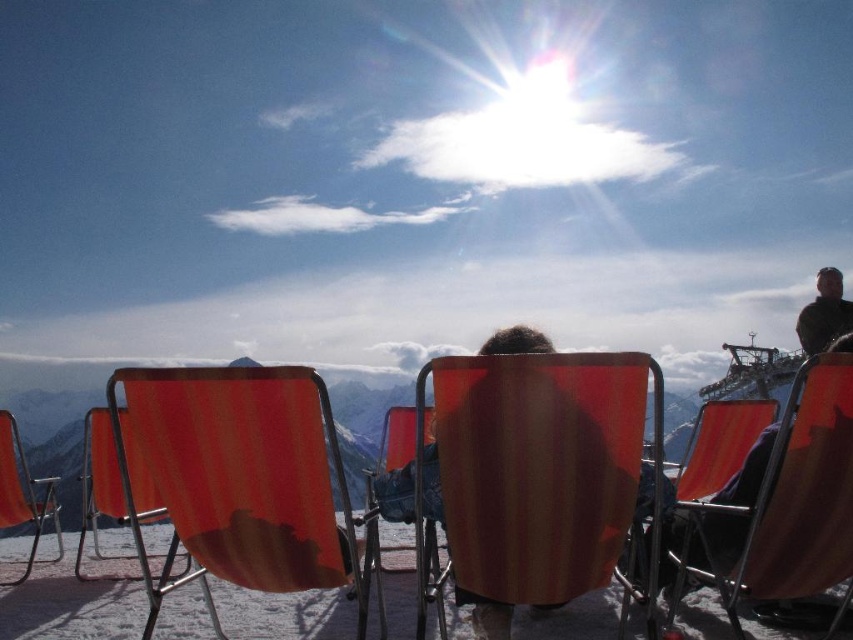
Who is lower down, orange fabric chair at center or matte orange chair at left?

matte orange chair at left is below.

Does orange fabric chair at center have a greater width compared to matte orange chair at left?

In fact, orange fabric chair at center might be narrower than matte orange chair at left.

Is point (802, 374) behind point (112, 451)?

No, it is in front of (112, 451).

I want to click on orange fabric chair at center, so click(799, 500).

Does orange fabric beach chair at center have a greater height compared to matte orange chair at left?

In fact, orange fabric beach chair at center may be shorter than matte orange chair at left.

Who is lower down, orange fabric beach chair at center or matte orange chair at left?

matte orange chair at left is lower down.

Where is `orange fabric beach chair at center`? This screenshot has height=640, width=853. orange fabric beach chair at center is located at coordinates (239, 476).

Can you confirm if orange fabric beach chair at center is positioned to the right of orange fabric chair at left?

Indeed, orange fabric beach chair at center is positioned on the right side of orange fabric chair at left.

Can you confirm if orange fabric beach chair at center is taller than orange fabric chair at left?

No, orange fabric beach chair at center is not taller than orange fabric chair at left.

You are a GUI agent. You are given a task and a screenshot of the screen. Output one action in this format:
    pyautogui.click(x=<x>, y=<y>)
    Task: Click on the orange fabric beach chair at center
    The width and height of the screenshot is (853, 640).
    Given the screenshot: What is the action you would take?
    pyautogui.click(x=239, y=476)